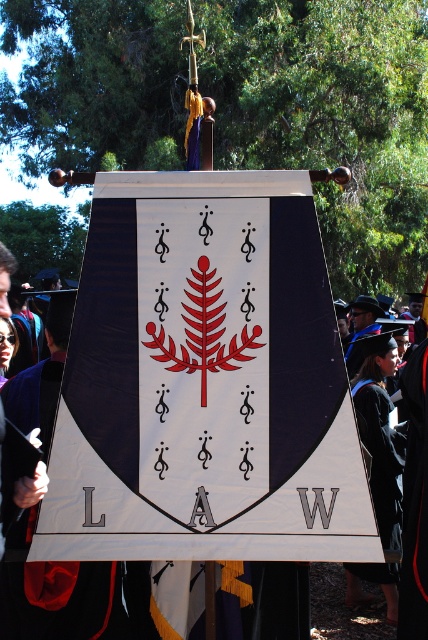
You are a photographer at the graduation ceremony. You need to capture a photo where both the matte black robe at center and the black matte graduation gown at lower right are visible. Given that the camera frame can only accommodate objects with a combined width of 1.5 meters, will the two robes fit within the frame if placed side by side?

The matte black robe at center is wider than the black matte graduation gown at lower right. Since their combined width must be under 1.5 meters to fit in the frame, but we don not know the exact widths, it is uncertain whether they will fit without additional information.

You are standing in front of the graduation ceremony banner. Which of the two points, point (20, 576) or point (397, 500), is closer to you?

Point (20, 576) is closer to the viewer than point (397, 500).